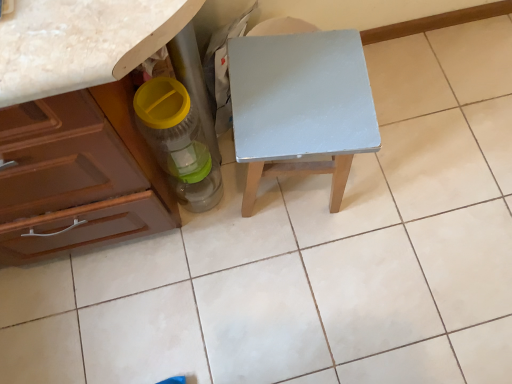
Identify the location of vacant space situated above light gray wood table at center (from a real-world perspective). The image size is (512, 384). 300,91.